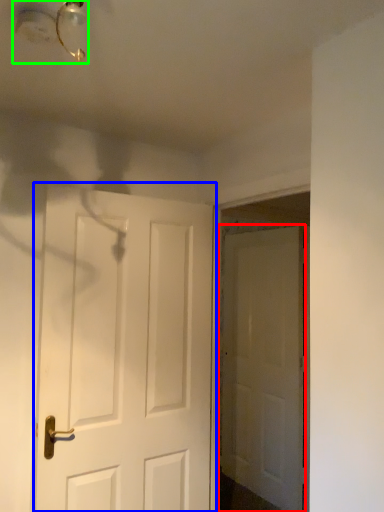
Question: Which is farther away from door (highlighted by a red box)? door (highlighted by a blue box) or light fixture (highlighted by a green box)?

Choices:
 (A) door
 (B) light fixture

Answer: (B)